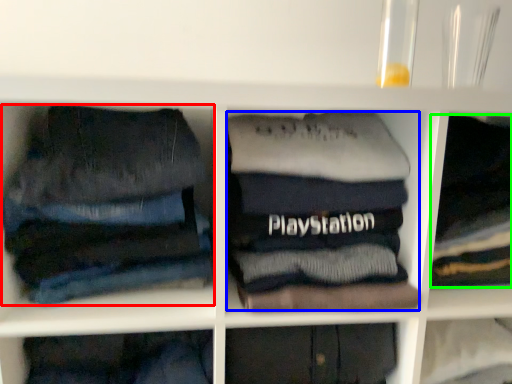
Question: Which object is the farthest from trousers (highlighted by a red box)? Choose among these: clothing (highlighted by a blue box) or clothing (highlighted by a green box).

Choices:
 (A) clothing
 (B) clothing

Answer: (B)